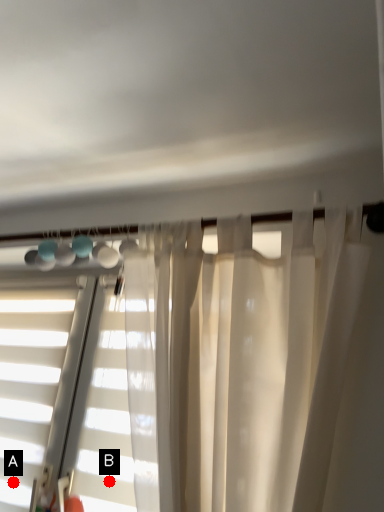
Question: Two points are circled on the image, labeled by A and B beside each circle. Which point is further to the camera?

Choices:
 (A) A is further
 (B) B is further

Answer: (A)